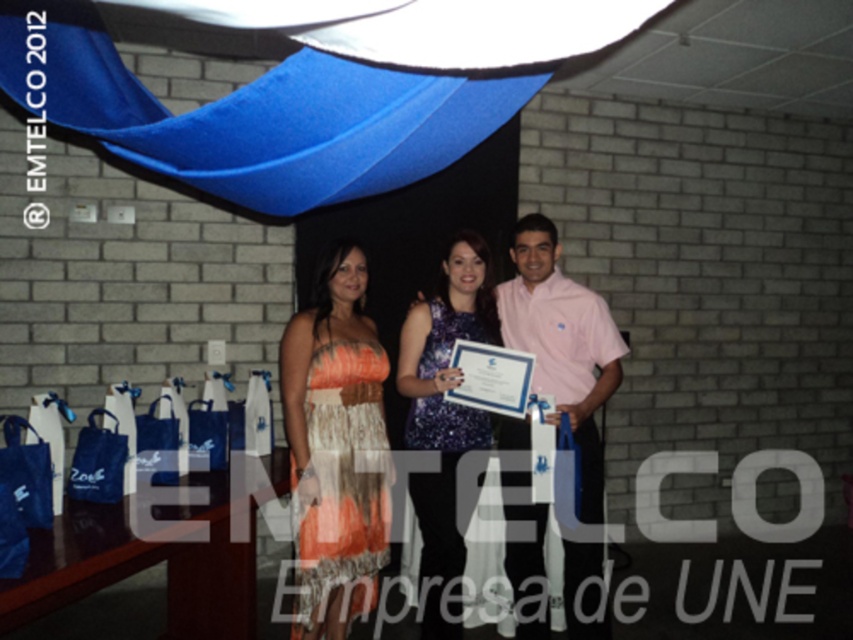
Does pink cotton shirt at center lie in front of shiny blue dress at center?

No, it is behind shiny blue dress at center.

Between point (558, 388) and point (439, 516), which one is positioned in front?

Point (439, 516)

Does point (538, 221) lie in front of point (480, 308)?

Yes, point (538, 221) is in front of point (480, 308).

Image resolution: width=853 pixels, height=640 pixels. What are the coordinates of `pink cotton shirt at center` in the screenshot? It's located at (561, 344).

Can you confirm if shiny blue dress at center is smaller than sparkly purple dress at center?

Actually, shiny blue dress at center might be larger than sparkly purple dress at center.

Identify the location of shiny blue dress at center. (438, 516).

Identify the location of shiny blue dress at center. Image resolution: width=853 pixels, height=640 pixels. (438, 516).

What do you see at coordinates (338, 477) in the screenshot? This screenshot has width=853, height=640. I see `orange lace dress at center` at bounding box center [338, 477].

Is the position of orange lace dress at center more distant than that of sparkly purple dress at center?

No, it is not.

Is point (296, 476) more distant than point (416, 300)?

That is False.

Locate an element on the screen. orange lace dress at center is located at coordinates (338, 477).